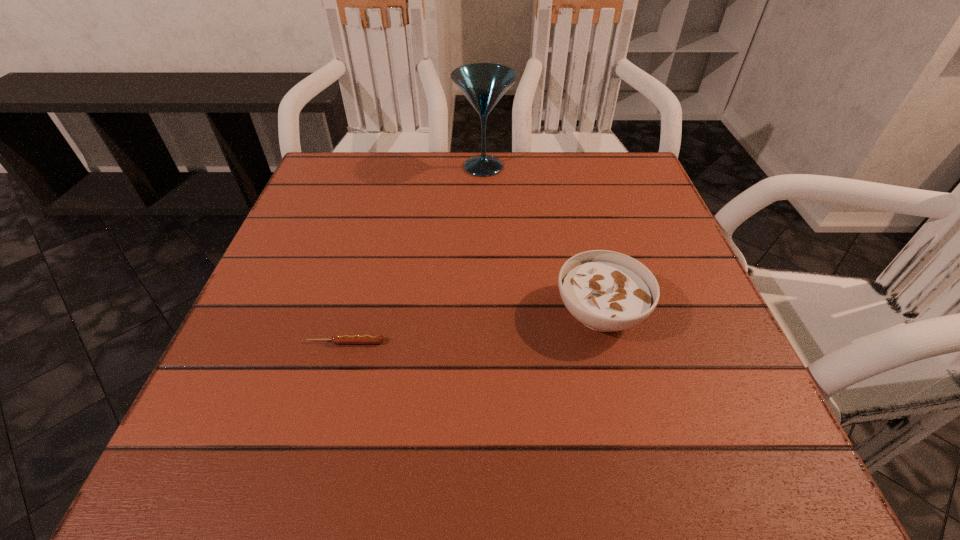
The height and width of the screenshot is (540, 960). Identify the location of vacant area between the martini and the soup bowl. (541, 240).

Identify the location of free space between the soup bowl and the second object from left to right. This screenshot has width=960, height=540. (541, 240).

This screenshot has width=960, height=540. I want to click on unoccupied area between the second object from left to right and the leftmost object, so click(x=415, y=254).

Where is `vacant space that's between the tallest object and the soup bowl`? The width and height of the screenshot is (960, 540). vacant space that's between the tallest object and the soup bowl is located at coordinates (541, 240).

The width and height of the screenshot is (960, 540). I want to click on vacant area that lies between the martini and the sausage, so (x=415, y=254).

At what (x,y) coordinates should I click in order to perform the action: click on free space between the second object from left to right and the leftmost object. Please return your answer as a coordinate pair (x, y). Looking at the image, I should click on (415, 254).

The height and width of the screenshot is (540, 960). I want to click on empty space between the second tallest object and the farthest object, so click(541, 240).

Image resolution: width=960 pixels, height=540 pixels. In order to click on empty location between the soup bowl and the sausage in this screenshot , I will do [473, 327].

Identify the location of free space between the second object from left to right and the rightmost object. The height and width of the screenshot is (540, 960). (541, 240).

What are the coordinates of `the closest object to the soup bowl` in the screenshot? It's located at (336, 339).